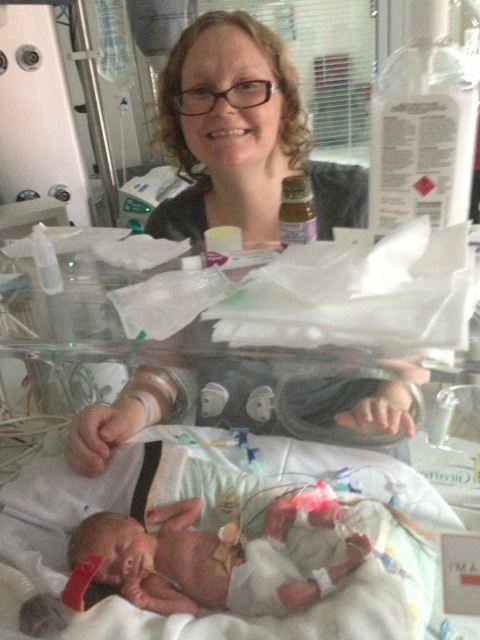
You are a photographer taking a closeup shot of the scene. You need to ensure both the matte black hair at upper center and the smooth skin newborn at lower left are in focus. Which object should you adjust your camera focus on first to ensure proper depth of field?

The matte black hair at upper center has a larger size compared to smooth skin newborn at lower left, so you should focus on the matte black hair at upper center first to ensure proper depth of field.

You are a photographer standing at a safe distance from the incubator room. You want to capture a closeup shot of the matte black hair at upper center without getting too close to the incubator. Given that your camera has a maximum zoom range of 25 inches, can you achieve this?

The distance between the matte black hair at upper center and the camera is 28.34 inches. Since your camera can only zoom up to 25 inches, you cannot achieve a closeup shot without moving closer.